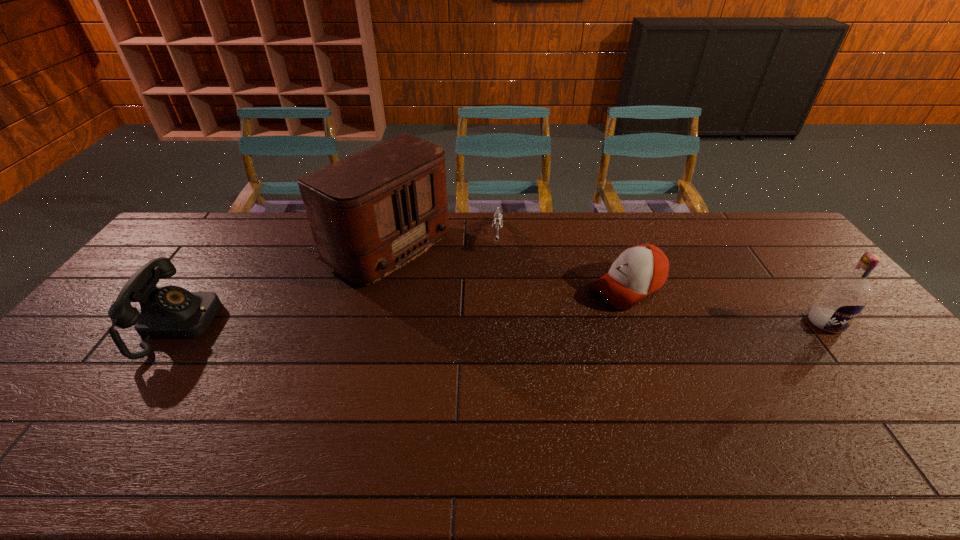
The height and width of the screenshot is (540, 960). Find the location of `free spot on the desktop that is between the third shortest object and the fourth shortest object and is positioned on the front panel of the radio receiver`. free spot on the desktop that is between the third shortest object and the fourth shortest object and is positioned on the front panel of the radio receiver is located at coordinates (508, 323).

What are the coordinates of `vacant space on the desktop that is between the third tallest object and the second tallest object and is positioned on the front-facing side of the baseball cap` in the screenshot? It's located at (562, 323).

Find the location of a particular element. This screenshot has height=540, width=960. vacant space on the desktop that is between the leftmost object and the second tallest object and is positioned aimed along the barrel of the gun is located at coordinates (492, 323).